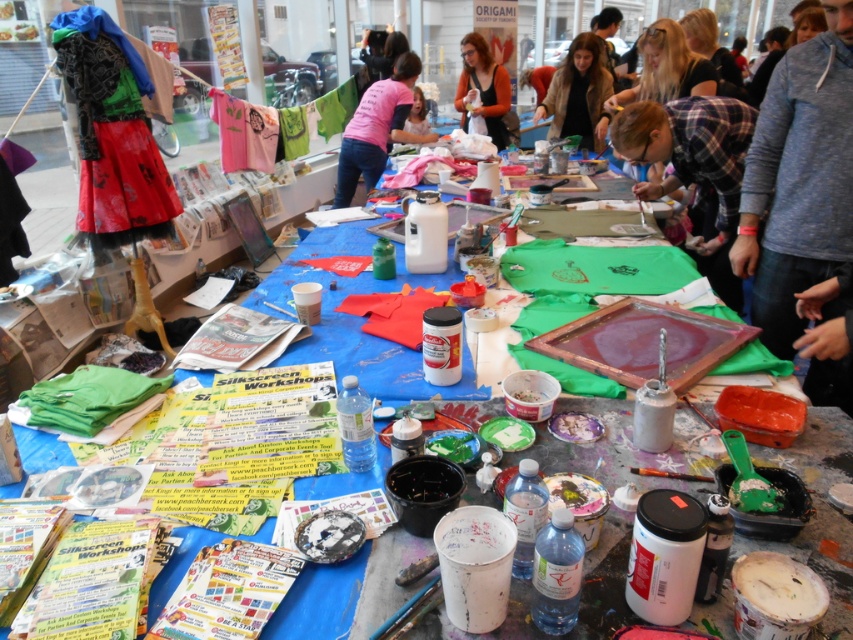
Question: Which object is positioned farthest from the plaid fabric shirt at center?

Choices:
 (A) gray sweater at upper right
 (B) pink fabric at center
 (C) matte orange sweater at center
 (D) brown textured jacket at center

Answer: (C)

Question: Which object is positioned closest to the pink fabric at center?

Choices:
 (A) plaid fabric shirt at center
 (B) gray sweater at upper right
 (C) matte orange sweater at center
 (D) brown textured jacket at center

Answer: (C)

Question: Is pink fabric at center closer to camera compared to brown textured jacket at center?

Choices:
 (A) yes
 (B) no

Answer: (B)

Question: Where is gray sweater at upper right located in relation to matte orange sweater at center in the image?

Choices:
 (A) below
 (B) above

Answer: (A)

Question: Does gray sweater at upper right have a lesser width compared to matte orange sweater at center?

Choices:
 (A) no
 (B) yes

Answer: (B)

Question: Which point is farther from the camera taking this photo?

Choices:
 (A) (386, 90)
 (B) (508, 97)

Answer: (B)